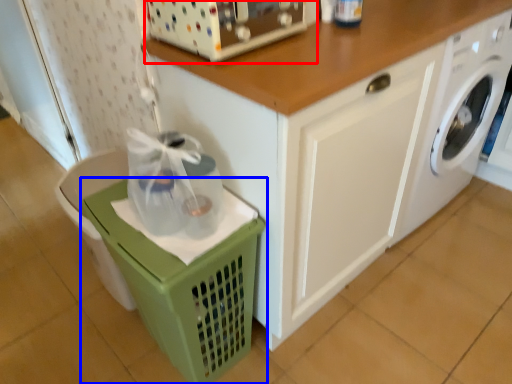
Question: Which object appears farthest to the camera in this image, appliance (highlighted by a red box) or basket (highlighted by a blue box)?

Choices:
 (A) appliance
 (B) basket

Answer: (B)